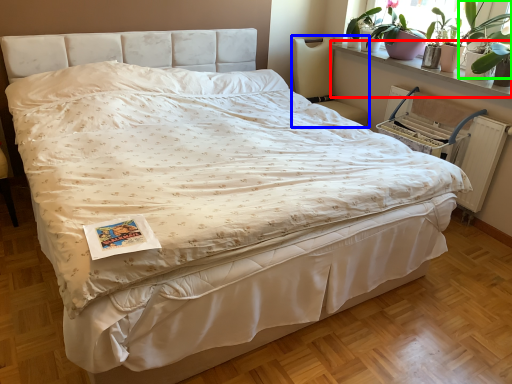
Question: Based on their relative distances, which object is nearer to window sill (highlighted by a red box)? Choose from chair (highlighted by a blue box) and plant (highlighted by a green box).

Choices:
 (A) chair
 (B) plant

Answer: (B)